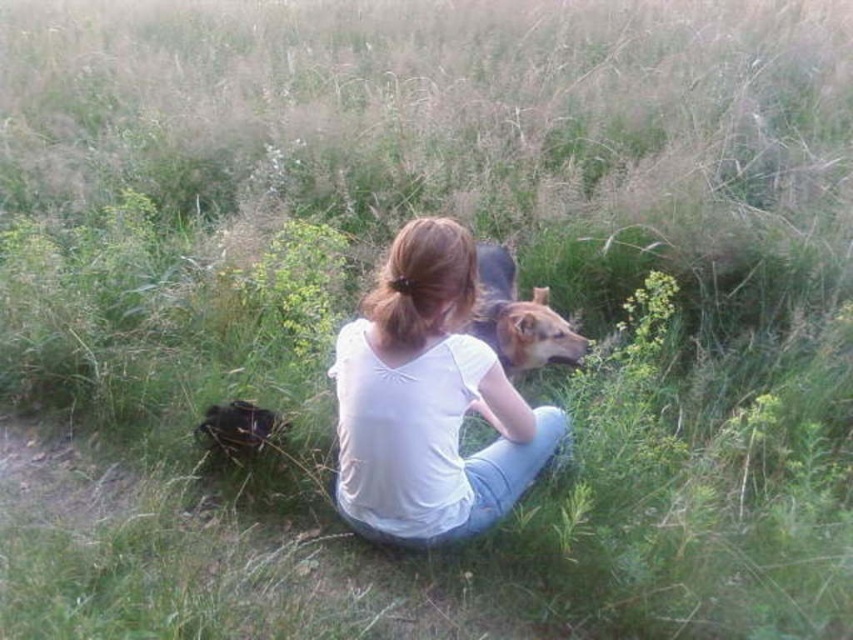
Does white cotton shirt at center come in front of brown fur dog at center?

Yes, it is in front of brown fur dog at center.

Does point (422, 413) come behind point (527, 326)?

No, it is in front of (527, 326).

Is point (403, 348) farther from viewer compared to point (479, 310)?

No.

You are a GUI agent. You are given a task and a screenshot of the screen. Output one action in this format:
    pyautogui.click(x=<x>, y=<y>)
    Task: Click on the white cotton shirt at center
    This screenshot has width=853, height=640.
    Given the screenshot: What is the action you would take?
    pyautogui.click(x=428, y=401)